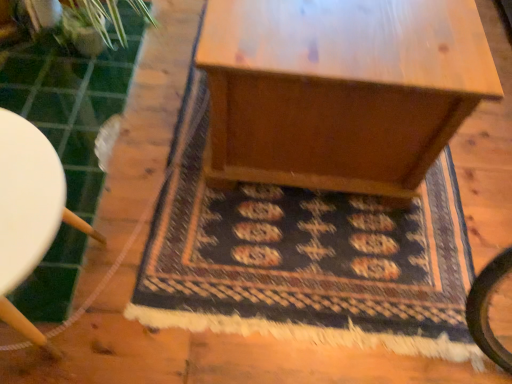
In order to click on free space in front of wooden table at center in this screenshot , I will do `click(297, 256)`.